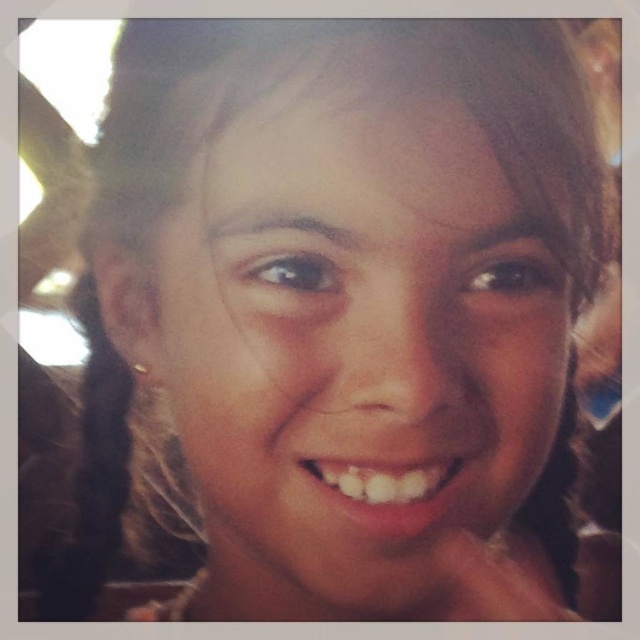
You are a photographer trying to capture a portrait. You notice the smooth skin face at center and the black hair at left in your viewfinder. Which object is located to the left of the other?

The black hair at left is located to the left of the smooth skin face at center.

You are an artist trying to paint this person. You notice two points on their face at coordinates point (401, 364) and point (90, 403). Which point should you shade more to create a sense of depth?

Point (401, 364) is closer to the viewer than point (90, 403). To create a sense of depth, you should shade point (90, 403) more because it is farther away and needs darker shading to appear recessed.

You are a photographer trying to capture a portrait. The subject has a smooth skin face at center. If your camera requires a minimum distance of 12 inches to focus properly, will you need to adjust your position?

The smooth skin face at center is only 10.41 inches away from the camera, which is less than the required 12 inches. Therefore, you need to move further back to ensure proper focus.